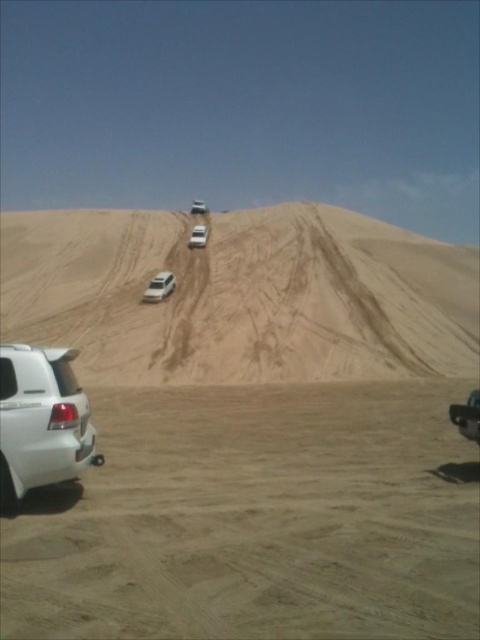
Consider the image. You are standing at the base of the sand dune and want to reach the closest point between point (420, 292) and point (205, 241). Which point should you head towards?

You should head towards point (420, 292) because it is closer to the camera, meaning it is nearer to your current position at the base of the sand dune.

You are standing at the point marked as point (255, 518) in the desert scene. What object is located exactly at this coordinate?

The white sand dirt track at lower left is located at point (255, 518).

You are driving a white matte suv at upper center and need to navigate onto the white sand dirt track at lower left. Based on the scene, will the SUV fit on the track?

The white sand dirt track at lower left has a lesser width compared to the white matte suv at upper center, so the SUV will not fit on the track.